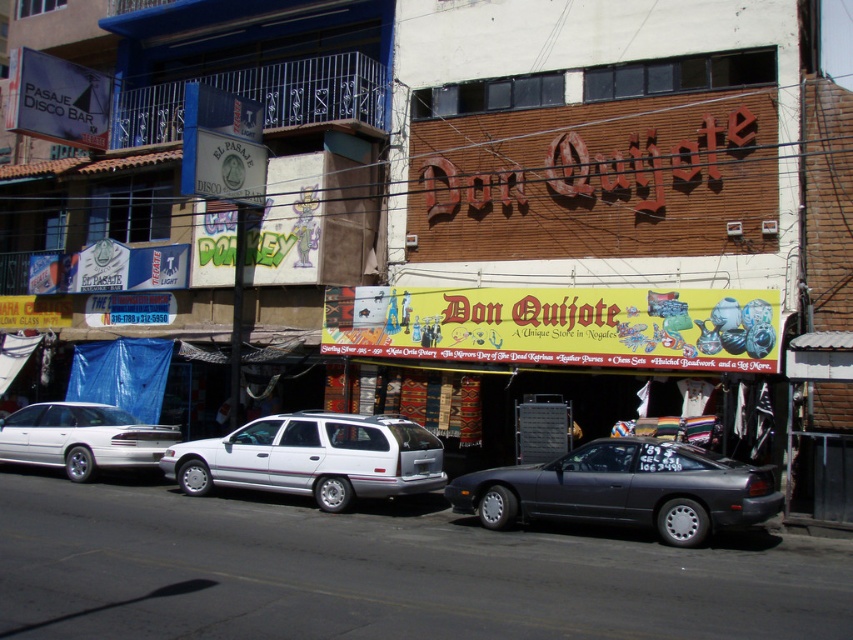
From the picture: You are a delivery person who needs to park your 1.8 meters tall delivery cart between the metallic gray car at center and the white matte station wagon at left. Can you fit your cart vertically between them?

The metallic gray car at center is taller than the white matte station wagon at left. Since the cart is 1.8 meters tall, it can fit vertically between them as long as the shorter vehicle is at least 1.8 meters in height. However, without knowing the exact height of the shorter vehicle, we cannot confirm if the cart will fit.

You are standing on the street looking at the building with the Don Quijote sign. There are two points marked on the building wall at coordinates point (500, 509) and point (347, 484). Which point is closer to you?

Point (500, 509) is closer to the viewer than point (347, 484).

You are a delivery person who needs to park your white matte station wagon at left in a parking spot that is exactly as wide as the metallic gray car at center. Can you safely park your car in that spot without hitting the sides?

The metallic gray car at center might be wider than white matte station wagon at left, so there is uncertainty. If the parking spot is exactly as wide as the metallic gray car, there is a risk that the white matte station wagon at left may not fit if the metallic gray car is indeed wider. However, if the station wagon is narrower, it might fit. Without exact measurements, it is uncertain.